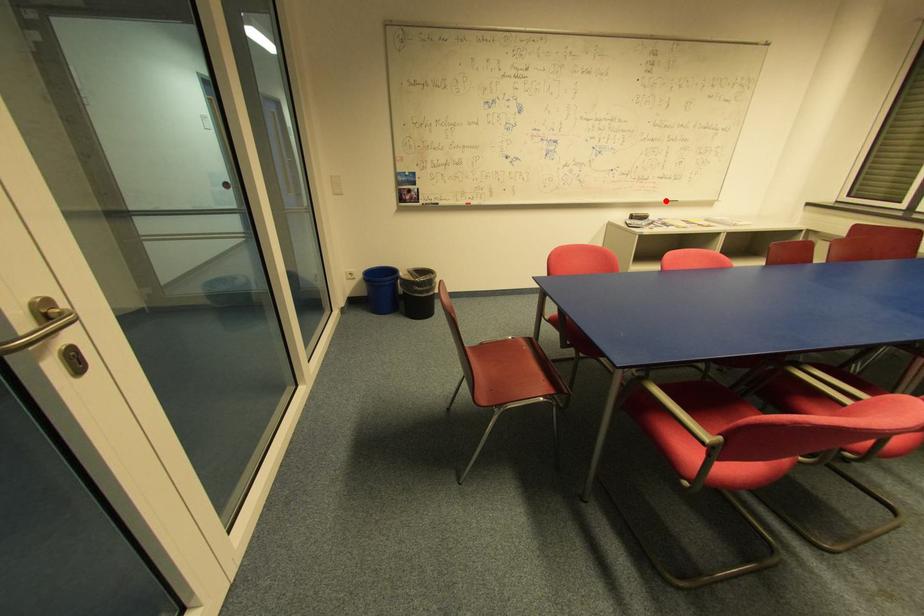
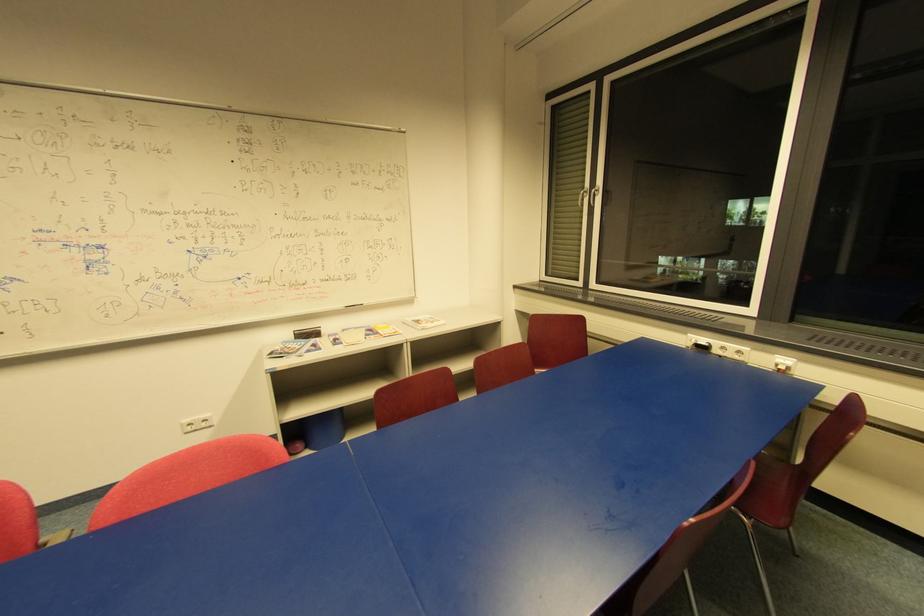
Question: I am providing you with two images of the same scene from different viewpoints. A red point is shown in image1. For the corresponding object point in image2, is it positioned nearer or farther from the camera?

Choices:
 (A) Nearer
 (B) Farther

Answer: (B)